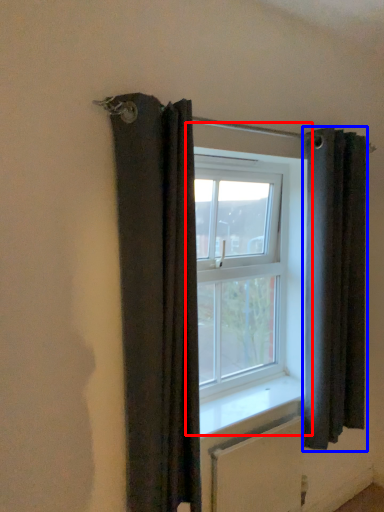
Question: Which of the following is the farthest to the observer, window (highlighted by a red box) or curtain (highlighted by a blue box)?

Choices:
 (A) window
 (B) curtain

Answer: (A)